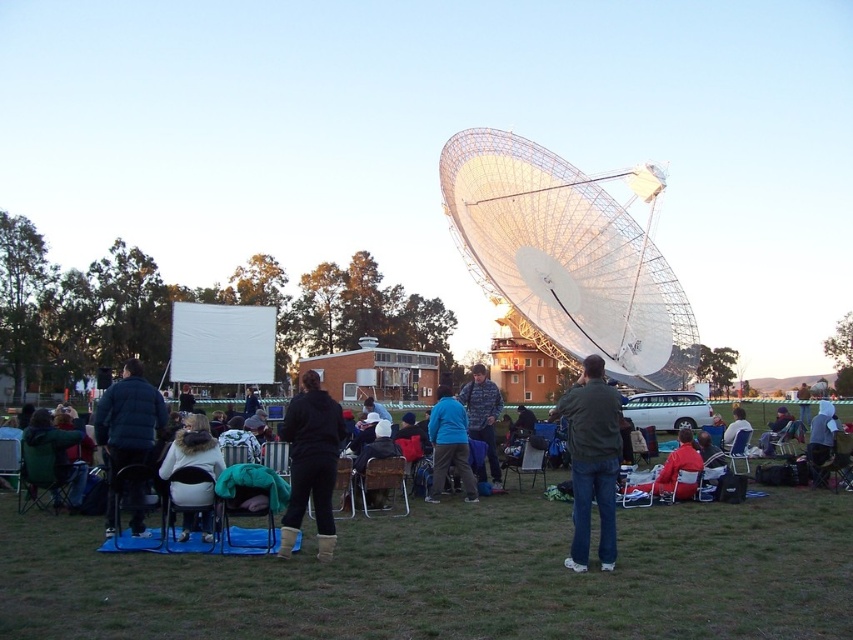
You are at an outdoor event and want to borrow a jacket from the person wearing the dark blue puffer jacket at left. Which direction should you walk relative to the green fabric jacket at lower left?

The dark blue puffer jacket at left is positioned on the right side of the green fabric jacket at lower left, so you should walk to the right relative to the green fabric jacket at lower left to reach the dark blue puffer jacket at left.

You are organizing a photo shoot and need to place two jackets, the camouflage jacket at center and the red fabric jacket at center, on a shelf. Which jacket should you place first to ensure they both fit on the shelf?

The camouflage jacket at center is bigger than the red fabric jacket at center, so you should place the camouflage jacket at center first to ensure both fit on the shelf.

You are standing at the front of the gathering and want to hand out a free astronomy poster to the person wearing the dark blue puffer jacket at left and the green fabric jacket at lower left. Which jacket should you approach first to ensure you give the poster without walking past them?

The dark blue puffer jacket at left is closer to the viewer, so you should approach the person wearing the dark blue puffer jacket at left first to give the poster without needing to walk past them.